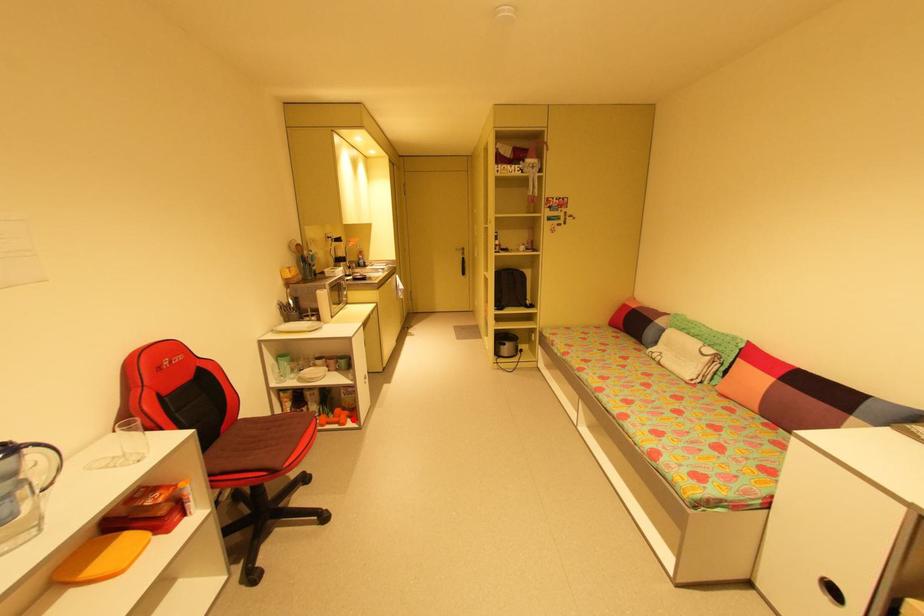
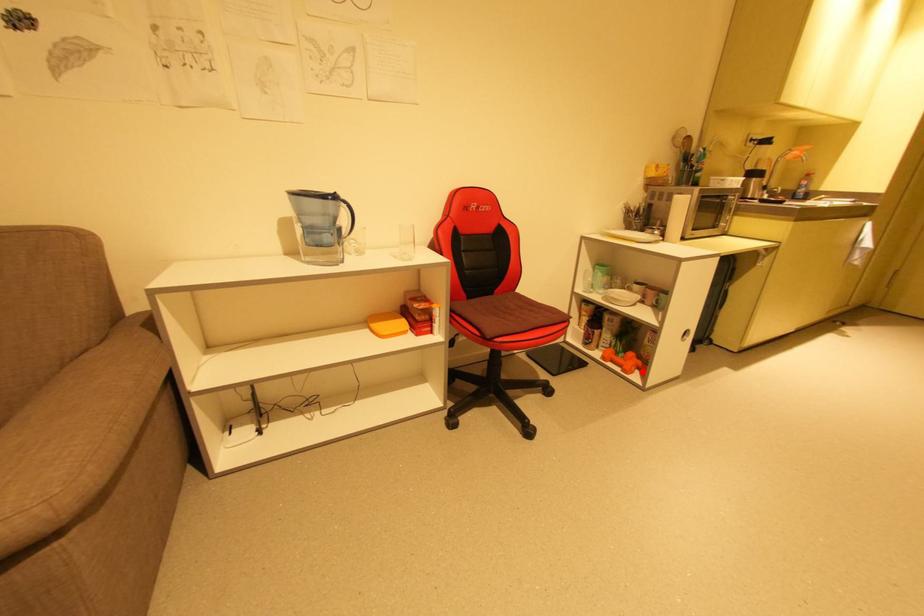
I am providing you with two images of the same scene from different viewpoints. A red point is marked on the first image and another point is marked on the second image. Is the red point in image1 aligned with the point shown in image2?

Yes